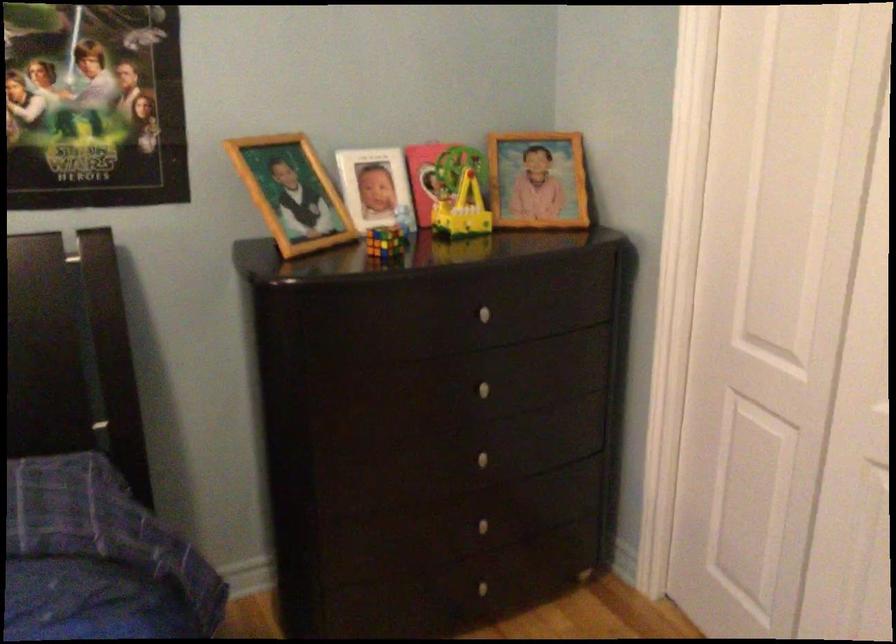
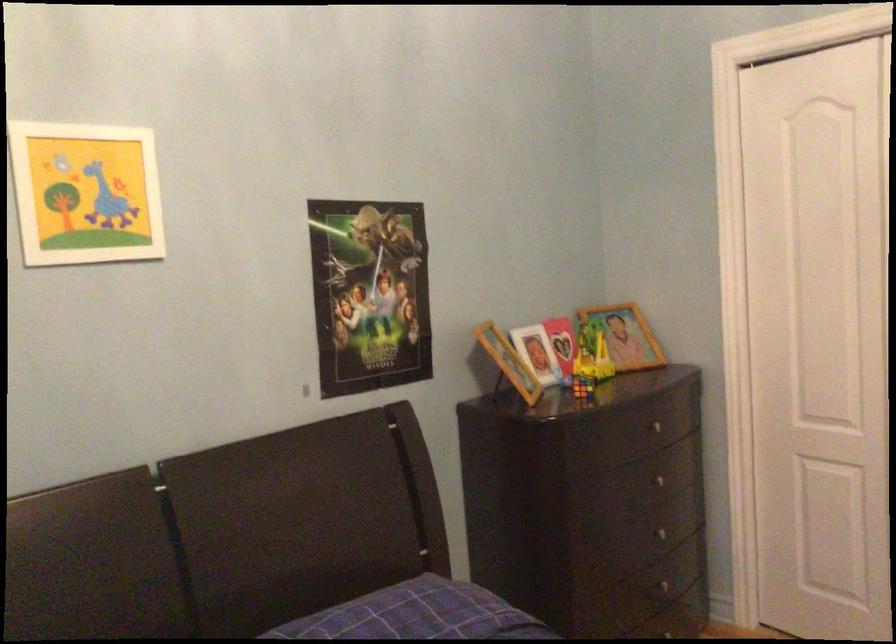
Find the pixel in the second image that matches (x=74, y=84) in the first image.

(369, 294)